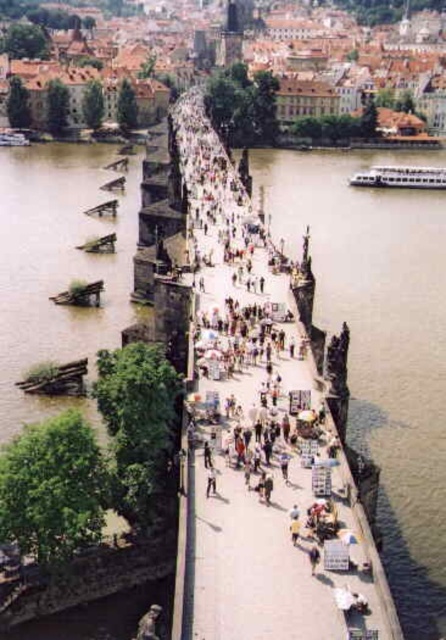
Is brown water at lower right behind dark gray stone statue at center?

Yes.

This screenshot has height=640, width=446. Describe the element at coordinates (380, 344) in the screenshot. I see `brown water at lower right` at that location.

The width and height of the screenshot is (446, 640). What do you see at coordinates (380, 344) in the screenshot? I see `brown water at lower right` at bounding box center [380, 344].

You are a GUI agent. You are given a task and a screenshot of the screen. Output one action in this format:
    pyautogui.click(x=<x>, y=<y>)
    Task: Click on the brown water at lower right
    This screenshot has height=640, width=446.
    Given the screenshot: What is the action you would take?
    pyautogui.click(x=380, y=344)